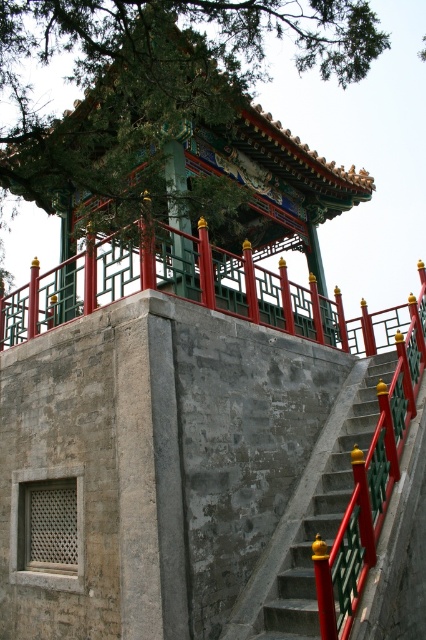
Question: Among these points, which one is nearest to the camera?

Choices:
 (A) (261, 560)
 (B) (166, 205)

Answer: (A)

Question: Which point is closer to the camera taking this photo?

Choices:
 (A) (187, 260)
 (B) (302, 44)
 (C) (233, 612)

Answer: (C)

Question: From the image, what is the correct spatial relationship of green textured tree at upper center in relation to concrete stairs at center?

Choices:
 (A) above
 (B) below

Answer: (A)

Question: Is the position of green textured tree at upper center more distant than that of green painted wood pillar at center?

Choices:
 (A) yes
 (B) no

Answer: (B)

Question: Is green textured tree at upper center bigger than concrete stairs at center?

Choices:
 (A) no
 (B) yes

Answer: (B)

Question: Among these points, which one is nearest to the camera?

Choices:
 (A) (88, 70)
 (B) (178, 236)

Answer: (A)